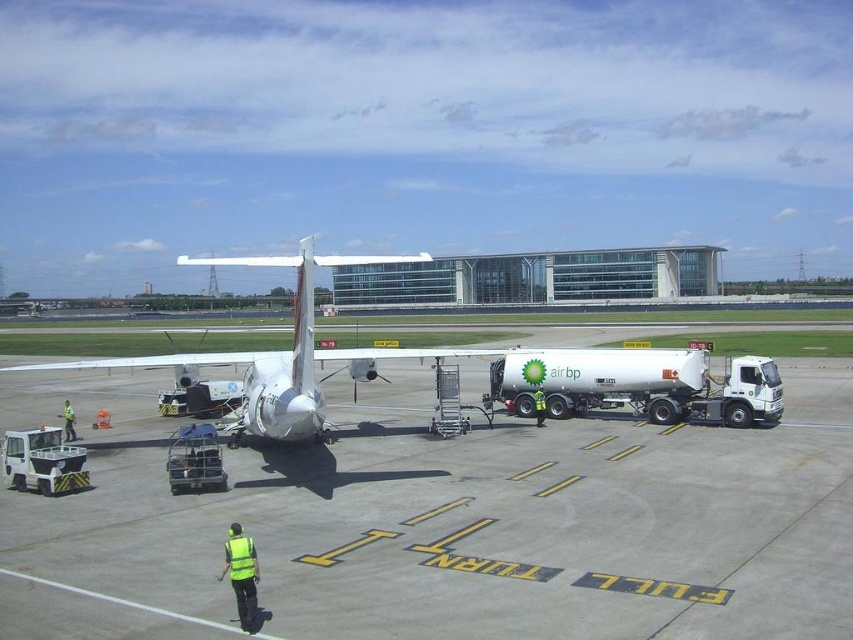
Who is shorter, white matte airplane at center or reflective yellow vest at lower center?

reflective yellow vest at lower center

Locate an element on the screen. The width and height of the screenshot is (853, 640). white matte airplane at center is located at coordinates (277, 353).

Measure the distance between smooth concrete tarmac at center and camera.

The distance of smooth concrete tarmac at center from camera is 7.17 meters.

Locate an element on the screen. Image resolution: width=853 pixels, height=640 pixels. smooth concrete tarmac at center is located at coordinates (444, 522).

Is point (664, 449) closer to viewer compared to point (242, 426)?

Yes, it is in front of point (242, 426).

Is the position of smooth concrete tarmac at center less distant than that of white matte airplane at center?

Yes, smooth concrete tarmac at center is in front of white matte airplane at center.

Is point (332, 480) farther from camera compared to point (287, 381)?

That is False.

Identify the location of smooth concrete tarmac at center. (444, 522).